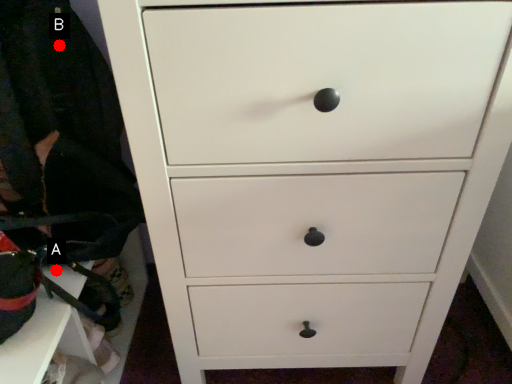
Question: Two points are circled on the image, labeled by A and B beside each circle. Which point is farther to the camera?

Choices:
 (A) A is further
 (B) B is further

Answer: (A)